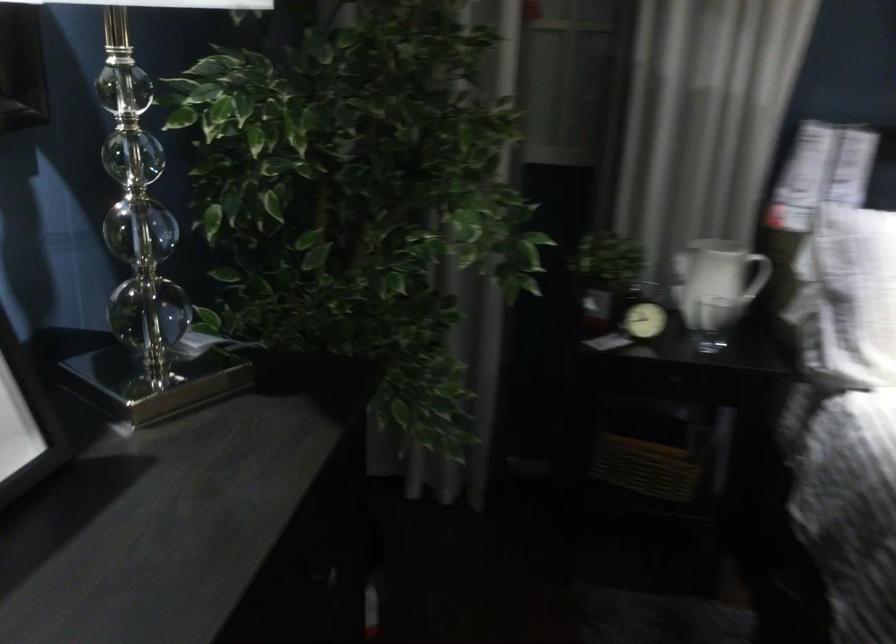
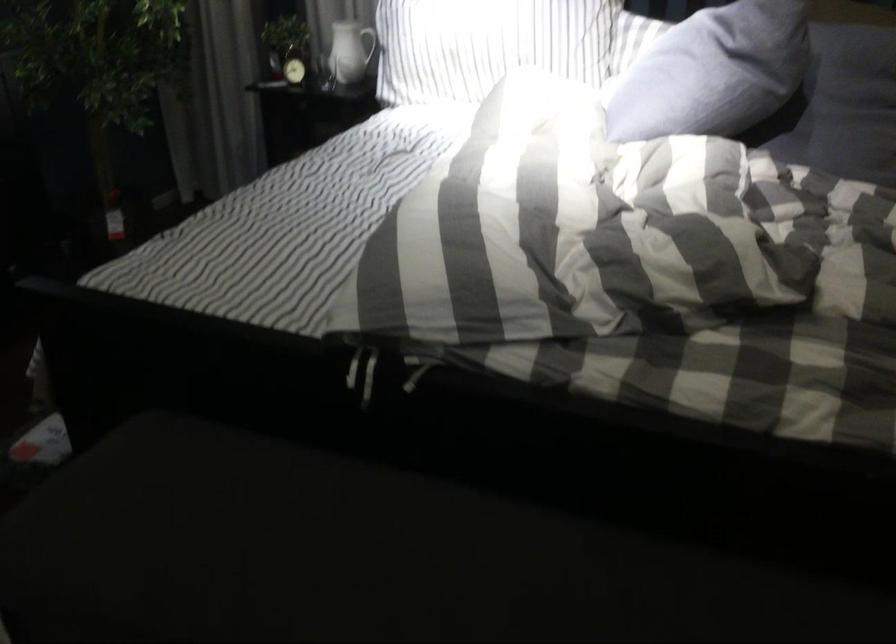
In the second image, find the point that corresponds to (737,270) in the first image.

(371, 44)